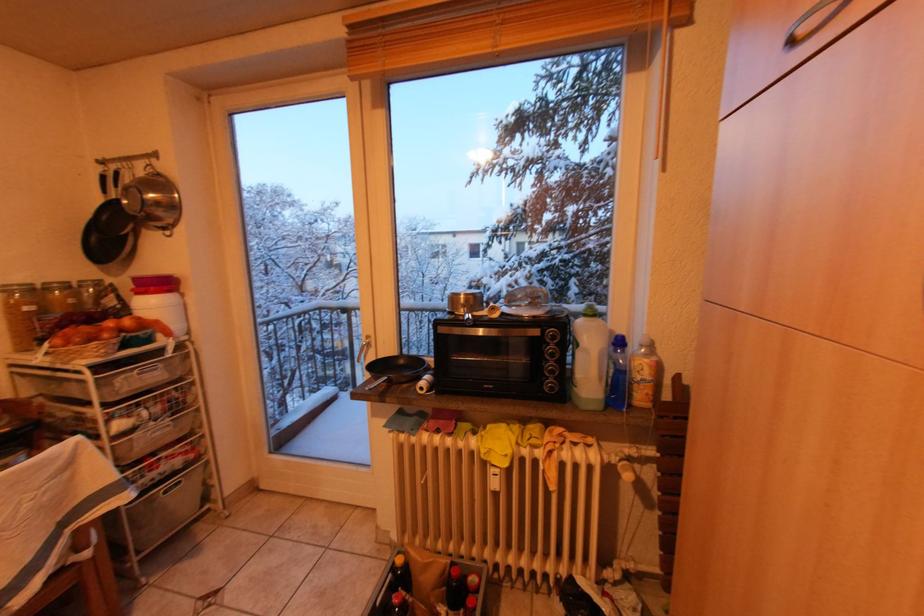
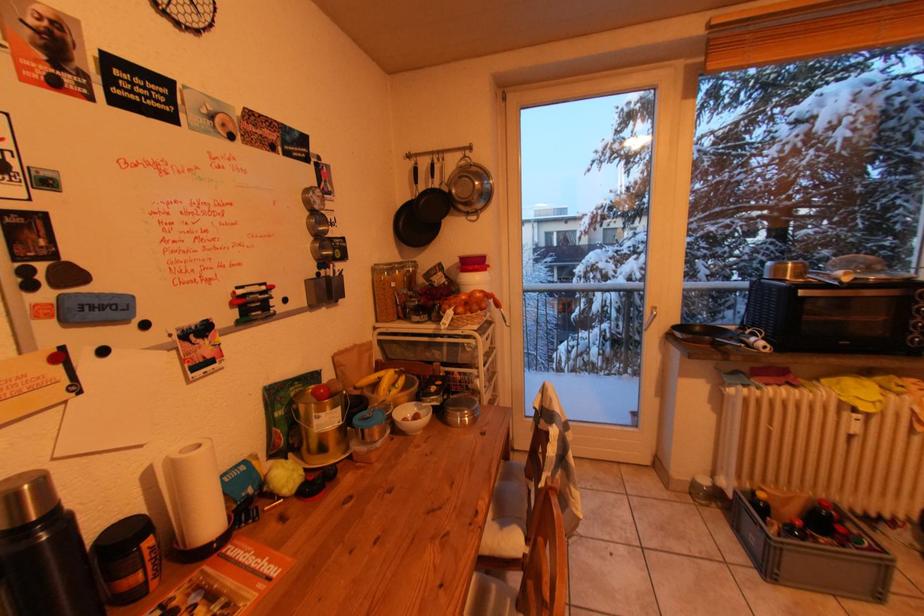
Question: In a continuous first-person perspective shot, in which direction is the camera moving?

Choices:
 (A) Left
 (B) Right
 (C) Forward
 (D) Backward

Answer: (A)